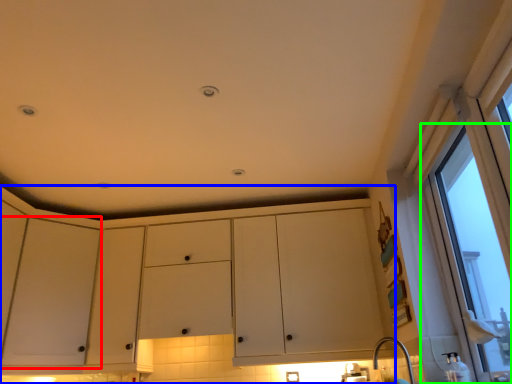
Question: Which is farther away from screen door (highlighted by a red box)? cabinetry (highlighted by a blue box) or window (highlighted by a green box)?

Choices:
 (A) cabinetry
 (B) window

Answer: (B)